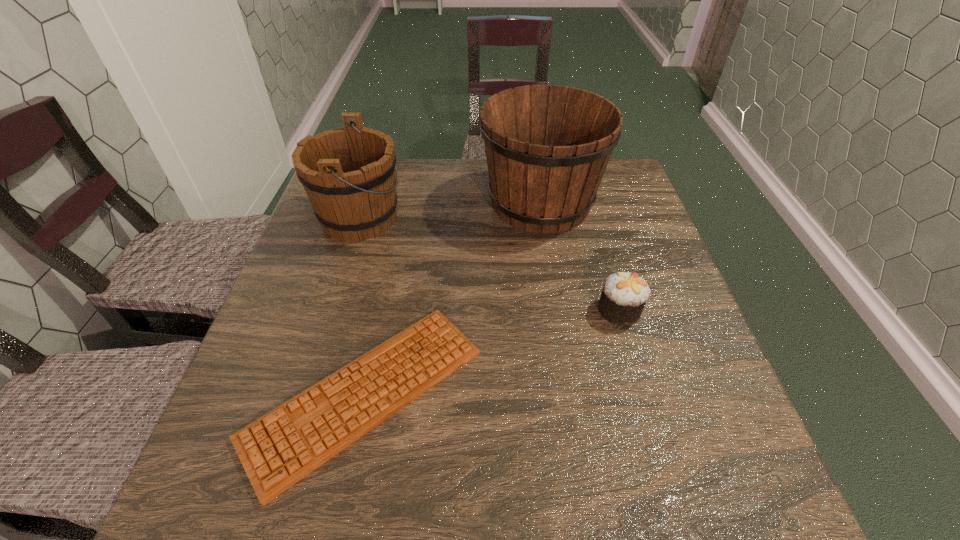
At what (x,y) coordinates should I click in order to perform the action: click on the right wine bucket. Please return your answer as a coordinate pair (x, y). Looking at the image, I should click on (547, 146).

I want to click on the left wine bucket, so click(x=348, y=173).

Locate an element on the screen. The height and width of the screenshot is (540, 960). the second shortest object is located at coordinates (624, 295).

In order to click on computer keyboard in this screenshot , I will do `click(280, 448)`.

Find the location of a particular element. This screenshot has width=960, height=540. vacant region located 0.210m on the left of the right wine bucket is located at coordinates (404, 202).

Image resolution: width=960 pixels, height=540 pixels. What are the coordinates of `vacant area located on the side of the left wine bucket with the handle for carrying` in the screenshot? It's located at click(x=430, y=218).

You are a GUI agent. You are given a task and a screenshot of the screen. Output one action in this format:
    pyautogui.click(x=<x>, y=<y>)
    Task: Click on the free spot located 0.250m on the back of the second shortest object
    This screenshot has height=540, width=960.
    Given the screenshot: What is the action you would take?
    pyautogui.click(x=594, y=225)

The width and height of the screenshot is (960, 540). Identify the location of vacant space situated on the right of the shortest object. (644, 394).

Identify the location of object located at the near edge. (280, 448).

Locate an element on the screen. This screenshot has width=960, height=540. wine bucket at the left edge is located at coordinates (348, 173).